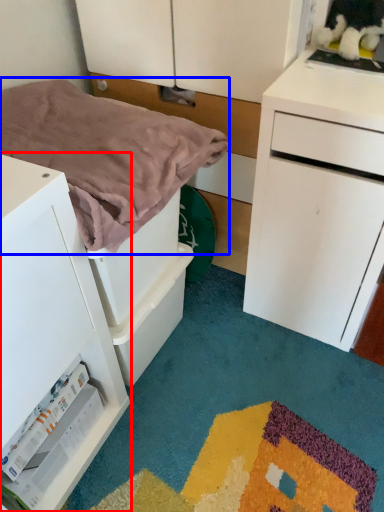
Question: Which point is closer to the camera, chest of drawers (highlighted by a red box) or blanket (highlighted by a blue box)?

Choices:
 (A) chest of drawers
 (B) blanket

Answer: (A)